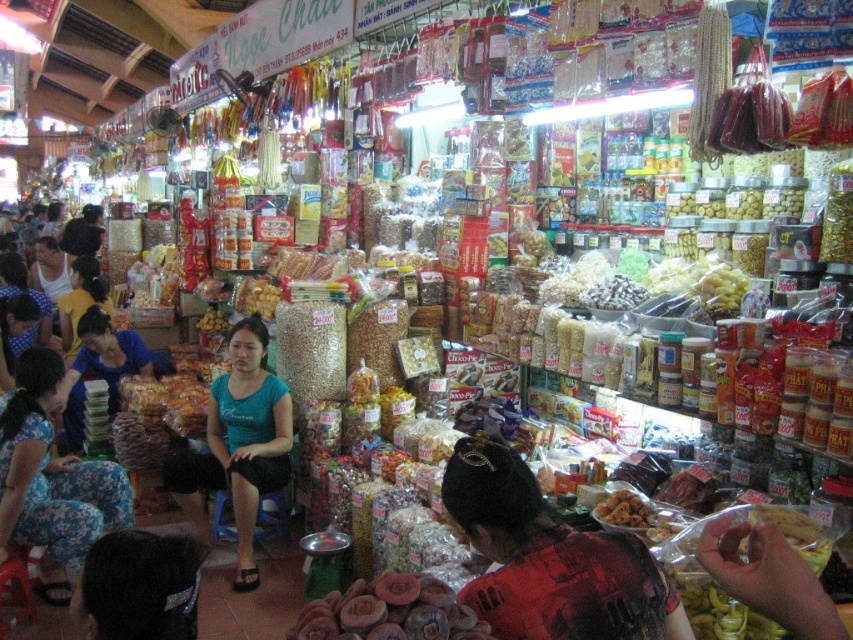
You are a customer in the market and want to buy both the purple matte dried mushrooms at lower center and the golden crispy snack at center. If you have a small bag that can only hold one item, which item should you choose based on their sizes?

The purple matte dried mushrooms at lower center is bigger than the golden crispy snack at center, so you should choose the golden crispy snack at center since it is smaller and fits better in the small bag.

You are a customer at the market and want to grab both the purple matte dried mushrooms at lower center and the golden crispy snack at center. Which item should you reach for first if you want to pick up the one on the left first?

The purple matte dried mushrooms at lower center is to the left of the golden crispy snack at center, so you should reach for the purple matte dried mushrooms at lower center first.